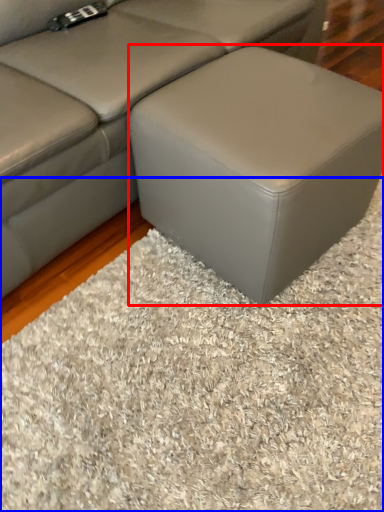
Question: Which object appears farthest to the camera in this image, stool (highlighted by a red box) or mat (highlighted by a blue box)?

Choices:
 (A) stool
 (B) mat

Answer: (A)